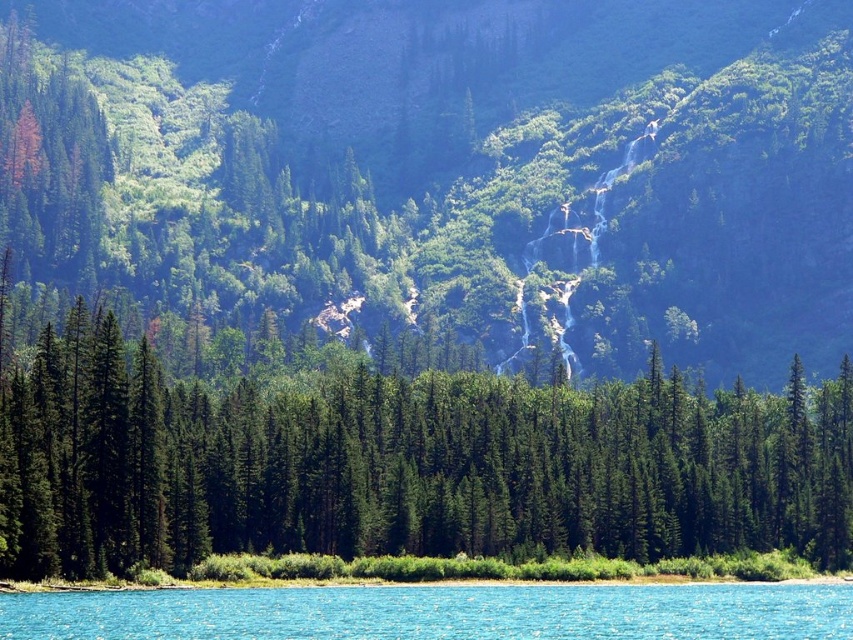
You are planning to set up a small tent in this landscape. The tent requires a flat area that is higher than the clear blue water at lower center. Can you find a suitable spot near the green matte tree at center?

Result: The green matte tree at center has a greater height compared to the clear blue water at lower center. Therefore, the area around the green matte tree at center is higher than the water, making it a suitable spot for setting up the tent.

You are standing at the bottom of the hill and see two points marked in the image. Which point is closer to you, point (x=613, y=435) or point (x=741, y=625)?

Point (x=741, y=625) is closer to you because it is in front of point (x=613, y=435).

Consider the image. You are planning to take a photo of the clear blue water at lower center and the green matte tree at center. Which object should you focus on first if you want to capture both in a single shot with maximum clarity?

The green matte tree at center is larger in size compared to the clear blue water at lower center, so you should focus on the green matte tree at center first to ensure both objects are in focus.